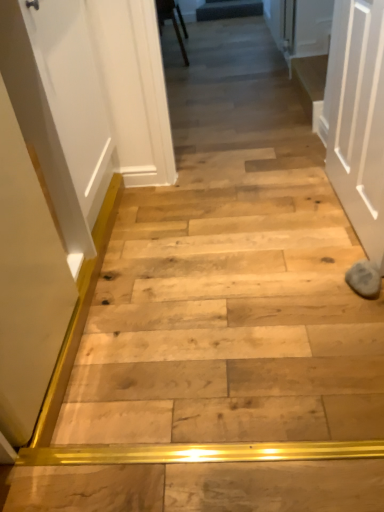
Question: Which direction should I rotate to look at wooden step at center, marked as the second stairwell in a top-to-bottom arrangement, — up or down?

Choices:
 (A) down
 (B) up

Answer: (B)

Question: Is white matte door at right looking in the opposite direction of wooden step at center, marked as the second stairwell in a top-to-bottom arrangement?

Choices:
 (A) yes
 (B) no

Answer: (B)

Question: Can we say white matte door at right lies outside wooden step at center, which is the 2th stairwell in back-to-front order?

Choices:
 (A) yes
 (B) no

Answer: (A)

Question: Is white matte door at right at the left side of wooden step at center, the 1th stairwell from the right?

Choices:
 (A) no
 (B) yes

Answer: (B)

Question: Is white matte door at right closer to camera compared to wooden step at center, the 1th stairwell positioned from the front?

Choices:
 (A) no
 (B) yes

Answer: (B)

Question: Is white matte door at right taller than wooden step at center, which is the 1th stairwell in bottom-to-top order?

Choices:
 (A) yes
 (B) no

Answer: (A)

Question: Considering the relative sizes of white matte door at right and wooden step at center, the 1th stairwell from the right, in the image provided, is white matte door at right smaller than wooden step at center, the 1th stairwell from the right,?

Choices:
 (A) no
 (B) yes

Answer: (A)

Question: Is dark gray fabric at upper center, the second stairwell positioned from the right, facing away from wooden chair at upper center?

Choices:
 (A) yes
 (B) no

Answer: (B)

Question: Is the depth of dark gray fabric at upper center, which is the second stairwell in front-to-back order, less than that of wooden chair at upper center?

Choices:
 (A) no
 (B) yes

Answer: (A)

Question: Considering the relative sizes of dark gray fabric at upper center, arranged as the 1th stairwell when viewed from the back, and wooden chair at upper center in the image provided, is dark gray fabric at upper center, arranged as the 1th stairwell when viewed from the back, wider than wooden chair at upper center?

Choices:
 (A) yes
 (B) no

Answer: (B)

Question: Does dark gray fabric at upper center, arranged as the 1th stairwell when viewed from the back, contain wooden chair at upper center?

Choices:
 (A) yes
 (B) no

Answer: (B)

Question: Is dark gray fabric at upper center, which appears as the 1th stairwell when viewed from the top, behind wooden chair at upper center?

Choices:
 (A) yes
 (B) no

Answer: (A)

Question: Is dark gray fabric at upper center, which appears as the 1th stairwell when viewed from the top, positioned beyond the bounds of wooden chair at upper center?

Choices:
 (A) yes
 (B) no

Answer: (A)

Question: Are white matte door at right and wooden chair at upper center making contact?

Choices:
 (A) no
 (B) yes

Answer: (A)